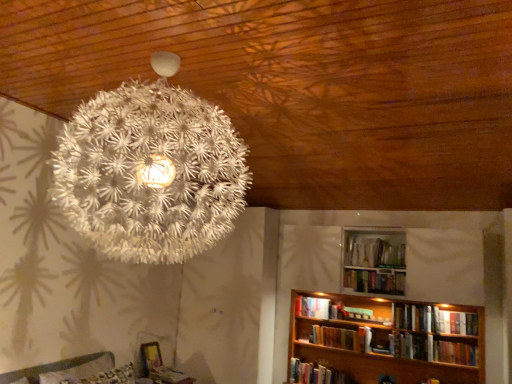
Question: Based on their sizes in the image, would you say white matte bookshelf at lower right, which is the second book in left-to-right order, is bigger or smaller than white matte bookshelf at lower right, the 3th book positioned from the left?

Choices:
 (A) small
 (B) big

Answer: (A)

Question: From a real-world perspective, relative to white matte bookshelf at lower right, the sixth book viewed from the right, is white matte bookshelf at lower right, arranged as the 7th book when viewed from the right, vertically above or below?

Choices:
 (A) below
 (B) above

Answer: (B)

Question: Considering the real-world distances, which object is farthest from the white textured lamp at upper center?

Choices:
 (A) white matte bookshelf at lower right, which is the second book in left-to-right order
 (B) hardcover book at center, acting as the 2th book starting from the right
 (C) wooden bookshelf at lower right
 (D) white matte book at lower center, arranged as the eighth book when viewed from the right
 (E) hardcover books at upper center, the 3th book in the right-to-left sequence

Answer: (B)

Question: Estimate the real-world distances between objects in this image. Which object is farther from the hardcover book at center, acting as the 2th book starting from the right?

Choices:
 (A) white matte book at lower center, the first book positioned from the left
 (B) white matte bookshelf at lower right, the sixth book viewed from the right
 (C) wooden bookshelf at lower right
 (D) white matte bookshelf at lower right, arranged as the 7th book when viewed from the right
 (E) hardcover book at upper right, which is the 8th book from left to right

Answer: (A)